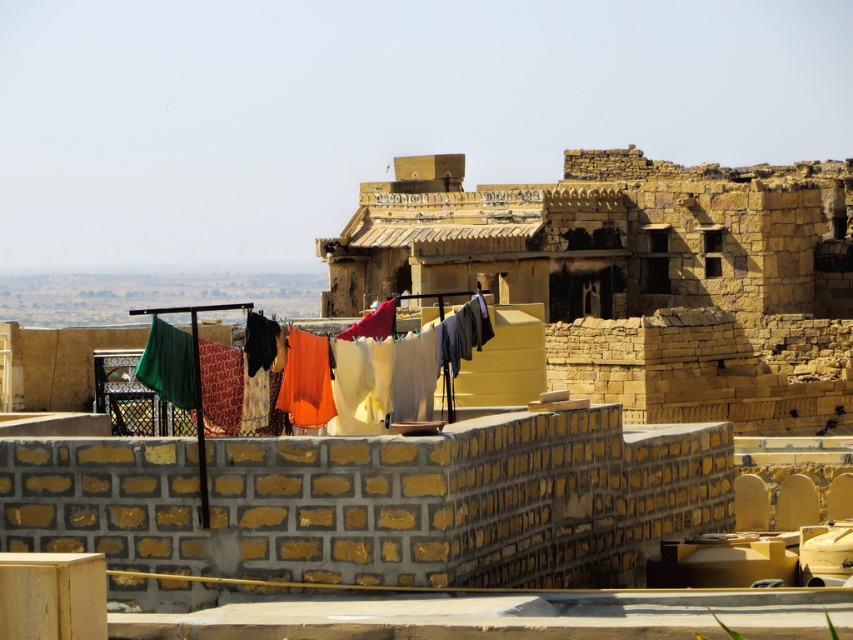
You are a delivery drone trying to navigate between the rustic stone fort at center and the textured fabric clothesline at center. Which structure has a smaller width according to the scene?

The rustic stone fort at center has a smaller width than the textured fabric clothesline at center.

In the scene shown: You are standing on the rooftop and want to take a photo of the rustic stone fort at center. Where should you position yourself to capture it in the frame?

To capture the rustic stone fort at center in your photo, position yourself at point (635,275).